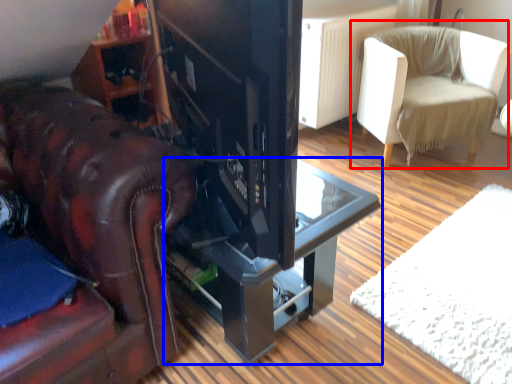
Question: Which point is closer to the camera, chair (highlighted by a red box) or table (highlighted by a blue box)?

Choices:
 (A) chair
 (B) table

Answer: (B)